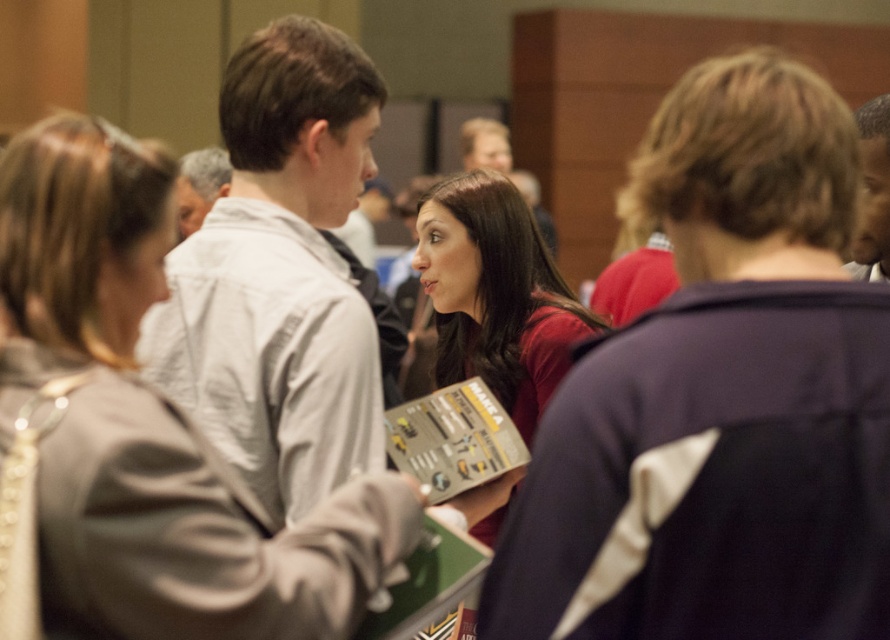
Based on the photo, you are a photographer at the event and want to capture a photo that includes both the white fabric jacket at center and the dark brown hair at upper right. To ensure both are visible, which object should you focus on first considering their height?

The white fabric jacket at center has a greater height compared to dark brown hair at upper right, so you should focus on the white fabric jacket at center first to ensure both are visible.

You are organizing a photo shoot and need to arrange two models wearing the dark blue jacket at center and the matte red shirt at center. Based on the scene description, which model should stand in the front to ensure both are visible?

The dark blue jacket at center has a lesser height compared to matte red shirt at center, so the model wearing the dark blue jacket at center should stand in front to ensure both are visible.